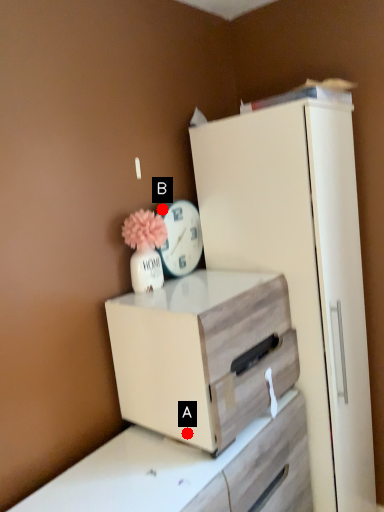
Question: Two points are circled on the image, labeled by A and B beside each circle. Which point is closer to the camera?

Choices:
 (A) A is closer
 (B) B is closer

Answer: (A)